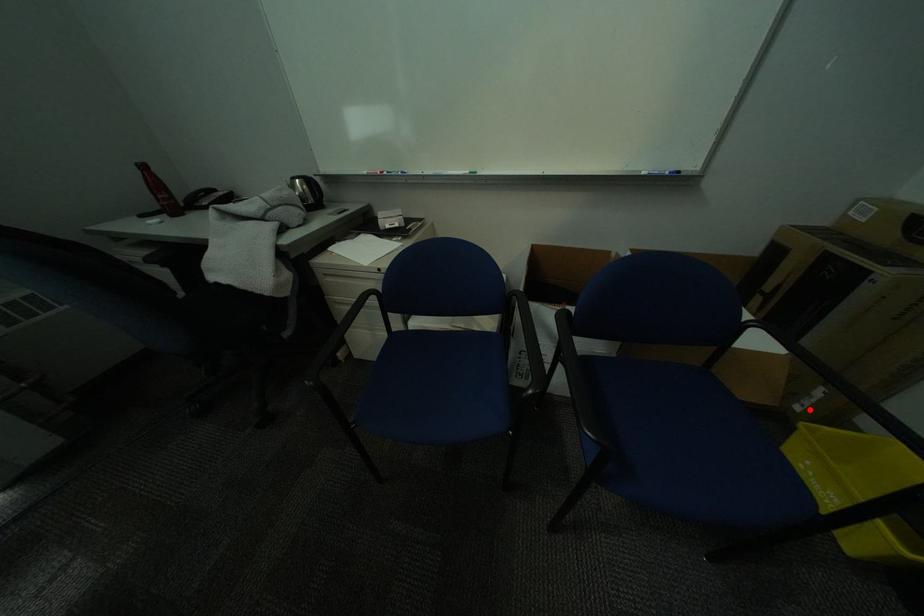
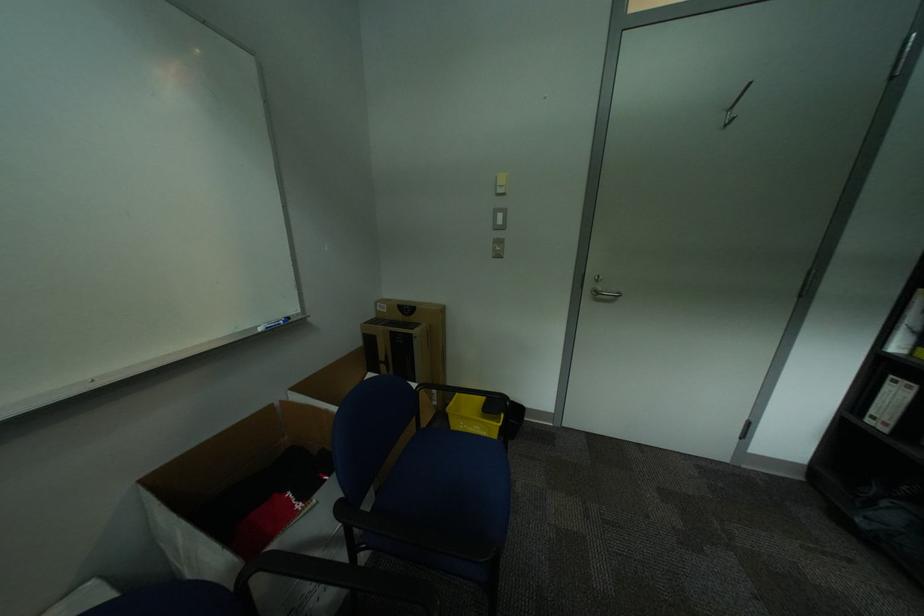
Question: I am providing you with two images of the same scene from different viewpoints. Given a red point in image1, look at the same physical point in image2. Is it:

Choices:
 (A) Closer to the viewpoint
 (B) Farther from the viewpoint

Answer: (B)